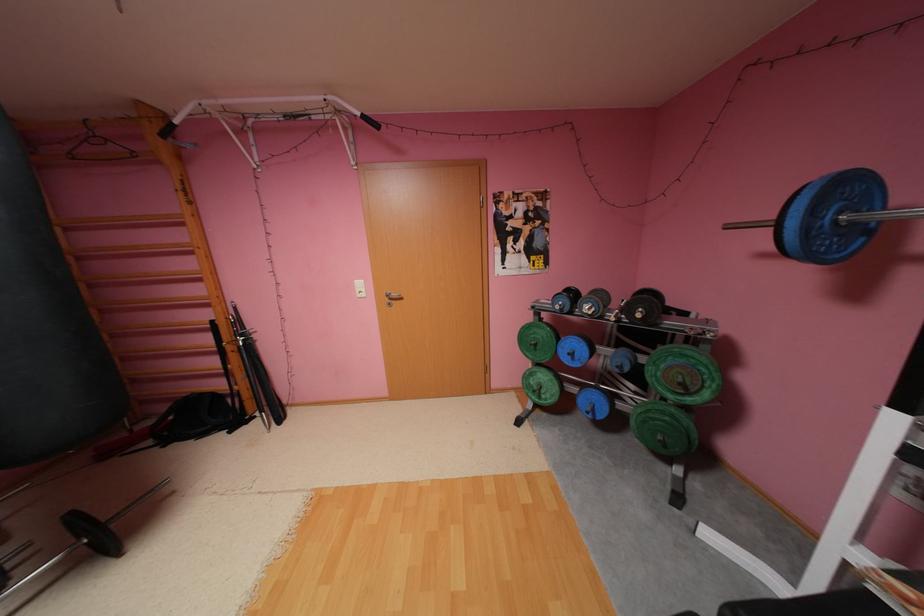
Where is `wooden clothes hanger`? wooden clothes hanger is located at coordinates (x=96, y=146).